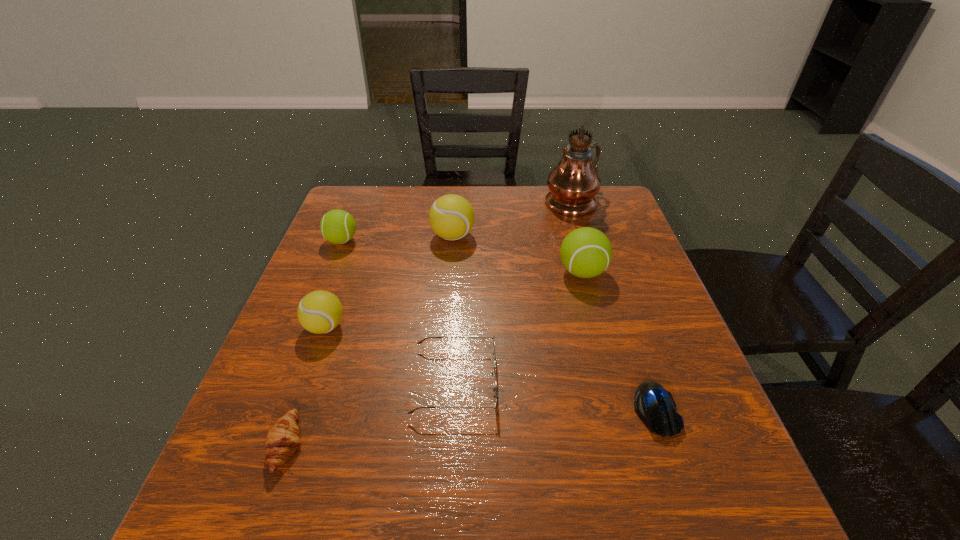
Identify the location of vacant area in the image that satisfies the following two spatial constraints: 1. on the button side of the shortest object; 2. on the front-facing side of the seventh tallest object. (667, 446).